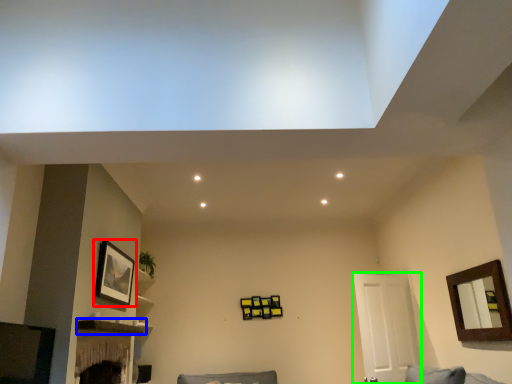
Question: Which is farther away from picture frame (highlighted by a red box)? shelf (highlighted by a blue box) or door (highlighted by a green box)?

Choices:
 (A) shelf
 (B) door

Answer: (B)